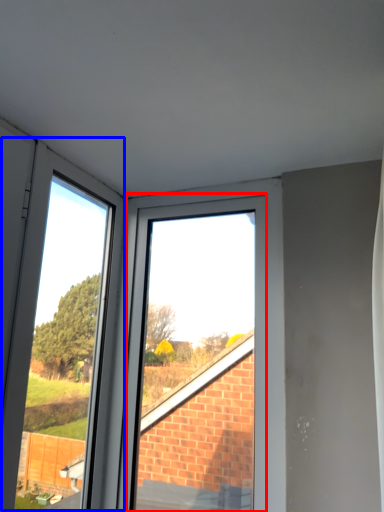
Question: Which point is closer to the camera, bay window (highlighted by a red box) or glass door (highlighted by a blue box)?

Choices:
 (A) bay window
 (B) glass door

Answer: (B)